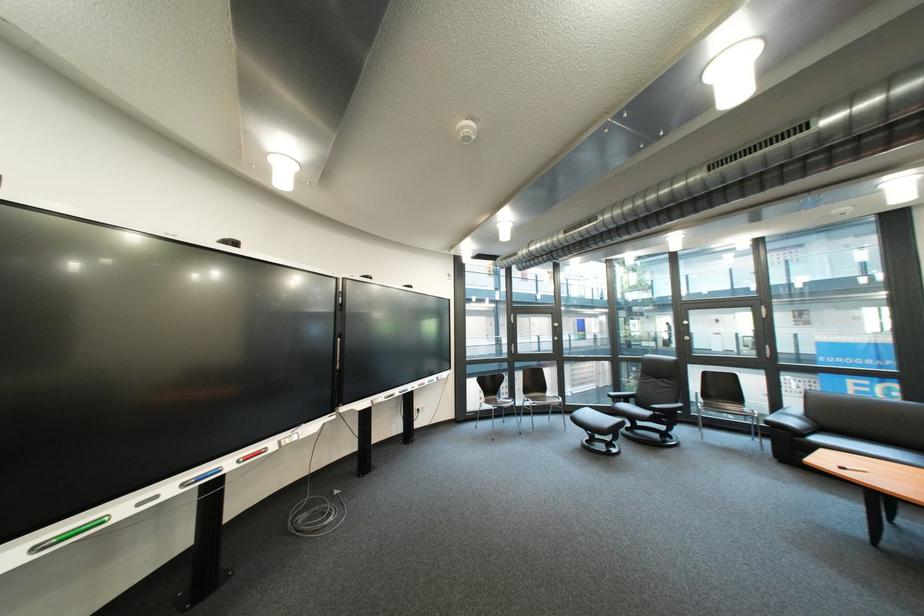
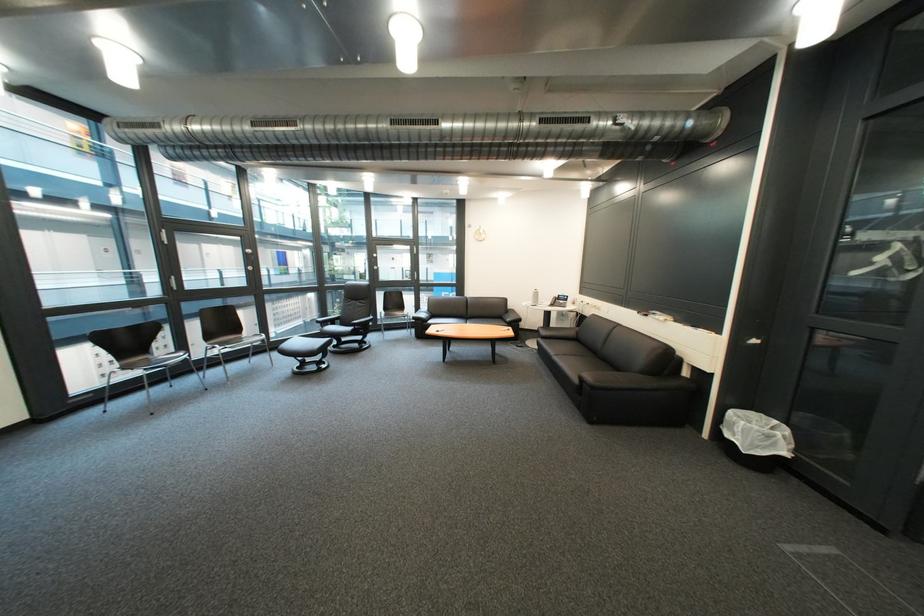
Locate, in the second image, the point that corresponds to point 665,416 in the first image.

(366, 331)